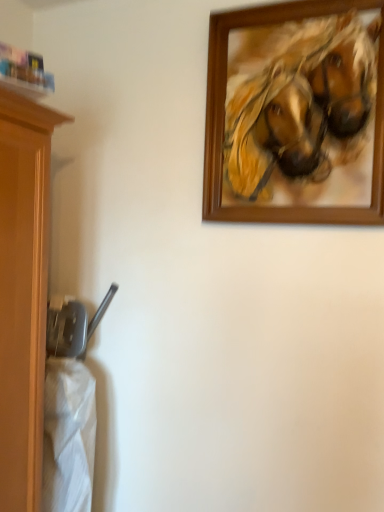
Image resolution: width=384 pixels, height=512 pixels. I want to click on wooden picture frame at upper right, so click(296, 114).

What is the approximate width of wooden picture frame at upper right?

wooden picture frame at upper right is 2.68 inches in width.

The width and height of the screenshot is (384, 512). What do you see at coordinates (296, 114) in the screenshot?
I see `wooden picture frame at upper right` at bounding box center [296, 114].

Find the location of `wooden picture frame at upper right`. wooden picture frame at upper right is located at coordinates (296, 114).